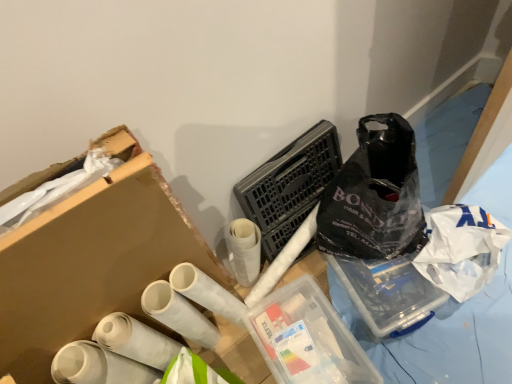
At what (x,y) coordinates should I click in order to perform the action: click on vacant point above transparent plastic container at center (from a real-world perspective). Please return your answer as a coordinate pair (x, y). The width and height of the screenshot is (512, 384). Looking at the image, I should click on (300, 347).